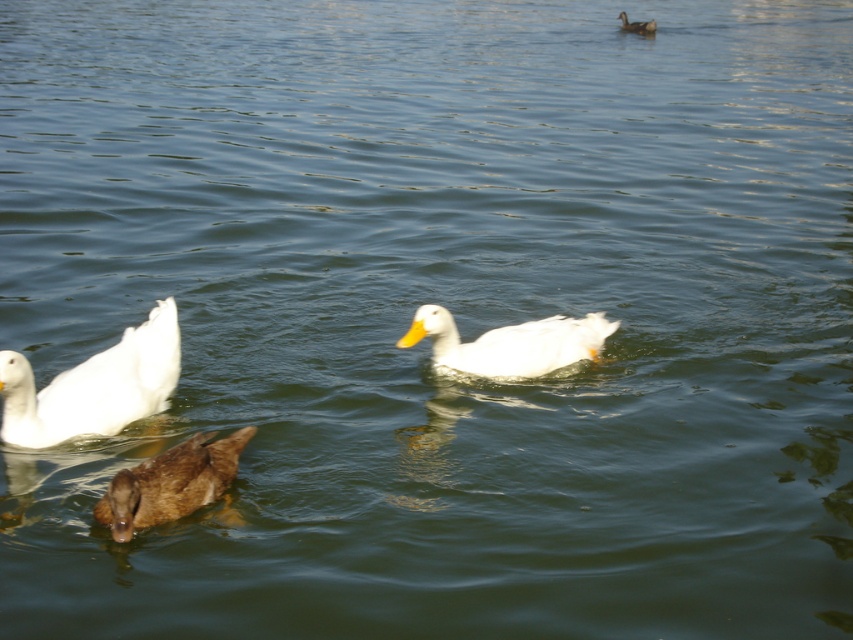
Question: Is white matte duck at lower left smaller than brown matte duck at center?

Choices:
 (A) no
 (B) yes

Answer: (A)

Question: Considering the relative positions of white matte duck at center and white matte duck at upper right in the image provided, where is white matte duck at center located with respect to white matte duck at upper right?

Choices:
 (A) right
 (B) left

Answer: (B)

Question: From the image, what is the correct spatial relationship of brown matte duck at center in relation to white matte duck at upper right?

Choices:
 (A) above
 (B) below

Answer: (B)

Question: Which object appears closest to the camera in this image?

Choices:
 (A) white matte duck at center
 (B) white matte duck at lower left
 (C) white matte duck at upper right
 (D) brown matte duck at center

Answer: (D)

Question: Among these points, which one is nearest to the camera?

Choices:
 (A) (152, 332)
 (B) (178, 493)
 (C) (653, 19)

Answer: (B)

Question: Which of these objects is positioned farthest from the white matte duck at lower left?

Choices:
 (A) brown matte duck at center
 (B) white matte duck at upper right
 (C) white matte duck at center

Answer: (B)